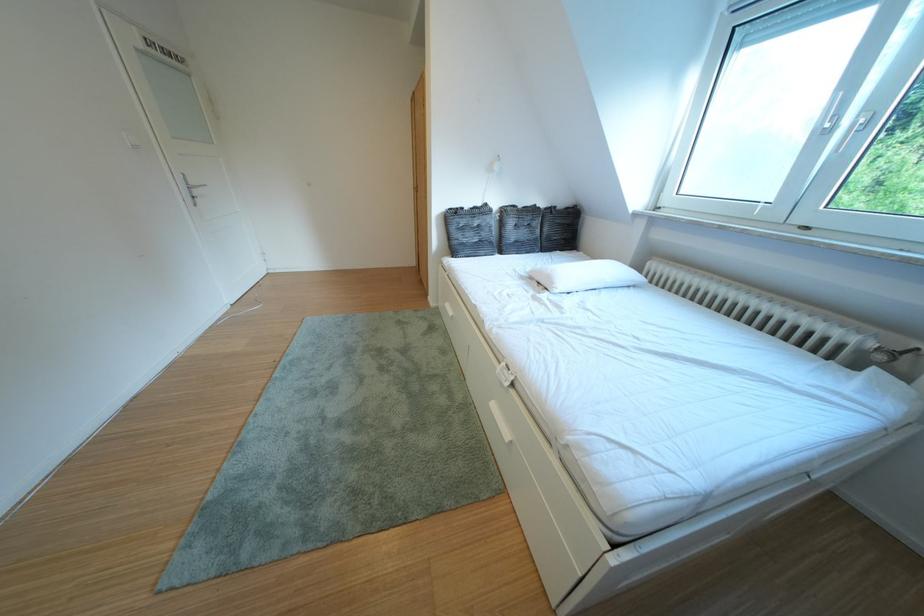
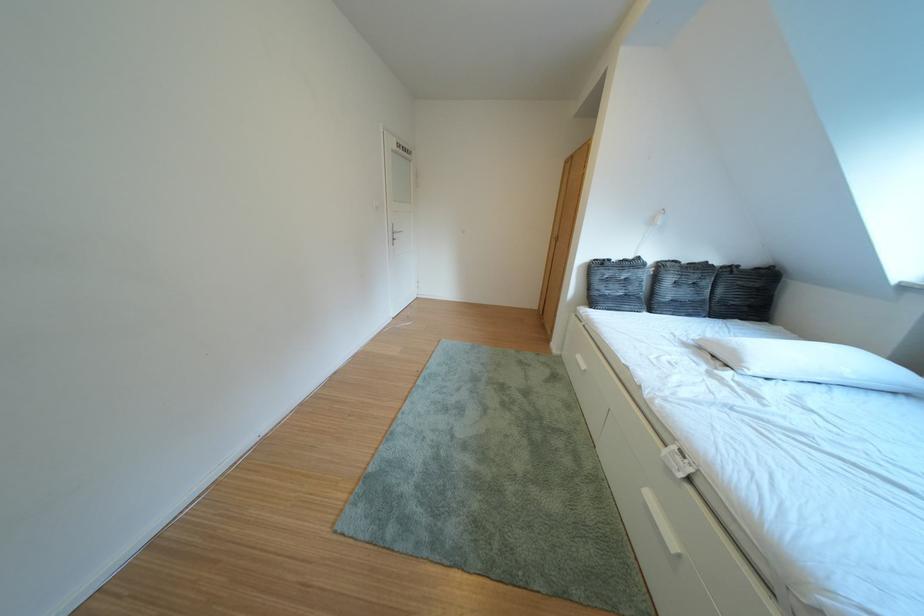
Question: How did the camera likely rotate?

Choices:
 (A) Left
 (B) Right
 (C) Up
 (D) Down

Answer: (A)